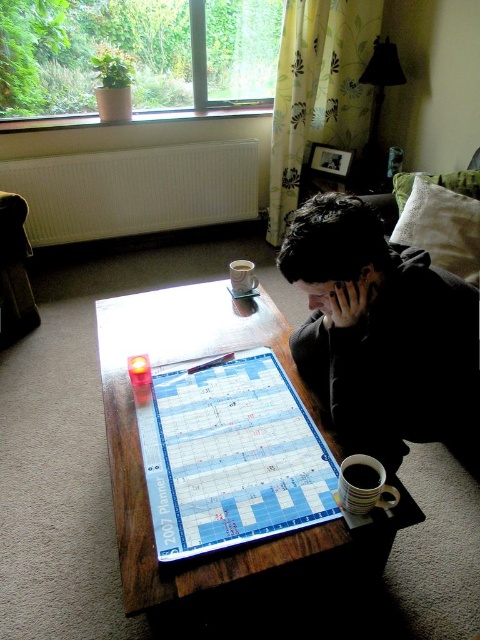
The height and width of the screenshot is (640, 480). Describe the element at coordinates (383, 333) in the screenshot. I see `black hoodie at lower right` at that location.

Does point (344, 372) come farther from viewer compared to point (252, 308)?

No, (344, 372) is closer to viewer.

The image size is (480, 640). What are the coordinates of `black hoodie at lower right` in the screenshot? It's located at (383, 333).

Can you confirm if black hoodie at lower right is positioned to the right of blue plastic planner at center?

Correct, you'll find black hoodie at lower right to the right of blue plastic planner at center.

Is black hoodie at lower right smaller than blue plastic planner at center?

Incorrect, black hoodie at lower right is not smaller in size than blue plastic planner at center.

Is point (468, 336) positioned behind point (156, 499)?

Yes, it is.

The image size is (480, 640). In order to click on black hoodie at lower right in this screenshot , I will do `click(383, 333)`.

Find the location of a particular element. Image resolution: width=480 pixels, height=640 pixels. blue plastic planner at center is located at coordinates (230, 456).

Between blue plastic planner at center and wooden table at center, which one has more height?

With more height is wooden table at center.

I want to click on blue plastic planner at center, so [230, 456].